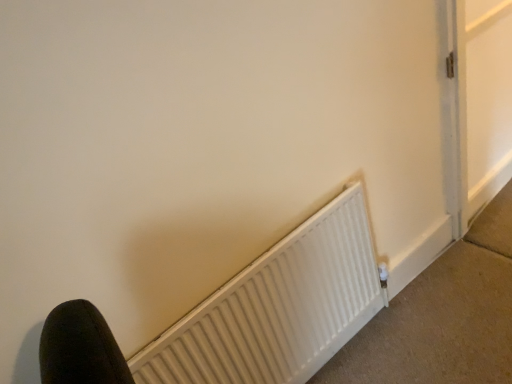
The image size is (512, 384). Describe the element at coordinates (278, 308) in the screenshot. I see `white matte radiator at lower center` at that location.

Where is `white matte radiator at lower center`? white matte radiator at lower center is located at coordinates click(x=278, y=308).

You are a GUI agent. You are given a task and a screenshot of the screen. Output one action in this format:
    pyautogui.click(x=<x>, y=<y>)
    Task: Click on the white matte radiator at lower center
    Image resolution: width=512 pixels, height=384 pixels.
    Given the screenshot: What is the action you would take?
    pyautogui.click(x=443, y=316)

What do you see at coordinates (443, 316) in the screenshot? I see `white matte radiator at lower center` at bounding box center [443, 316].

Where is `white matte radiator at lower center`? The height and width of the screenshot is (384, 512). white matte radiator at lower center is located at coordinates (278, 308).

Between white matte radiator at lower center and white matte radiator at lower center, which one appears on the left side from the viewer's perspective?

white matte radiator at lower center is more to the left.

Considering the relative positions of white matte radiator at lower center and white matte radiator at lower center in the image provided, is white matte radiator at lower center behind white matte radiator at lower center?

Yes, it is behind white matte radiator at lower center.

Is point (478, 274) closer or farther from the camera than point (276, 380)?

Point (478, 274) is positioned farther from the camera compared to point (276, 380).

From the image's perspective, between white matte radiator at lower center and white matte radiator at lower center, who is located below?

From the image's view, white matte radiator at lower center is below.

Looking at this image, from a real-world perspective, relative to white matte radiator at lower center, is white matte radiator at lower center vertically above or below?

From a real-world perspective, white matte radiator at lower center is physically below white matte radiator at lower center.

Considering the relative sizes of white matte radiator at lower center and white matte radiator at lower center in the image provided, is white matte radiator at lower center thinner than white matte radiator at lower center?

In fact, white matte radiator at lower center might be wider than white matte radiator at lower center.

Does white matte radiator at lower center have a lesser height compared to white matte radiator at lower center?

Correct, white matte radiator at lower center is not as tall as white matte radiator at lower center.

Based on the photo, who is bigger, white matte radiator at lower center or white matte radiator at lower center?

Bigger between the two is white matte radiator at lower center.

Is white matte radiator at lower center located outside white matte radiator at lower center?

Yes, white matte radiator at lower center is outside of white matte radiator at lower center.

Would you say white matte radiator at lower center is a long distance from white matte radiator at lower center?

Actually, white matte radiator at lower center and white matte radiator at lower center are a little close together.

Is white matte radiator at lower center facing away from white matte radiator at lower center?

white matte radiator at lower center is not turned away from white matte radiator at lower center.

How many degrees apart are the facing directions of white matte radiator at lower center and white matte radiator at lower center?

The facing directions of white matte radiator at lower center and white matte radiator at lower center are 89.8 degrees apart.

Locate an element on the screen. The height and width of the screenshot is (384, 512). concrete below the white matte radiator at lower center (from the image's perspective) is located at coordinates (443, 316).

Consider the image. Considering the relative positions of white matte radiator at lower center and white matte radiator at lower center in the image provided, is white matte radiator at lower center to the left or to the right of white matte radiator at lower center?

From the image, it's evident that white matte radiator at lower center is to the left of white matte radiator at lower center.

Consider the image. Considering their positions, is white matte radiator at lower center located in front of or behind white matte radiator at lower center?

Visually, white matte radiator at lower center is located in front of white matte radiator at lower center.

Does point (342, 227) come in front of point (433, 362)?

That is True.

From the image's perspective, is white matte radiator at lower center on white matte radiator at lower center?

Yes, from the image's perspective, white matte radiator at lower center is on top of white matte radiator at lower center.

From a real-world perspective, who is located lower, white matte radiator at lower center or white matte radiator at lower center?

From a 3D spatial view, white matte radiator at lower center is below.

Which of these two, white matte radiator at lower center or white matte radiator at lower center, is thinner?

white matte radiator at lower center is thinner.

Can you confirm if white matte radiator at lower center is taller than white matte radiator at lower center?

Correct, white matte radiator at lower center is much taller as white matte radiator at lower center.

Which of these two, white matte radiator at lower center or white matte radiator at lower center, is bigger?

With larger size is white matte radiator at lower center.

Is white matte radiator at lower center completely or partially outside of white matte radiator at lower center?

That's correct, white matte radiator at lower center is outside of white matte radiator at lower center.

Are white matte radiator at lower center and white matte radiator at lower center far apart?

No, white matte radiator at lower center is in close proximity to white matte radiator at lower center.

Is white matte radiator at lower center oriented towards white matte radiator at lower center?

Yes, white matte radiator at lower center is aimed at white matte radiator at lower center.

How many degrees apart are the facing directions of white matte radiator at lower center and white matte radiator at lower center?

There is a 89.8-degree angle between the facing directions of white matte radiator at lower center and white matte radiator at lower center.

In the image, there is a white matte radiator at lower center. Identify the location of concrete below it (from the image's perspective). This screenshot has width=512, height=384. (443, 316).

Locate an element on the screen. This screenshot has width=512, height=384. concrete behind the white matte radiator at lower center is located at coordinates (443, 316).

In the image, there is a white matte radiator at lower center. Identify the location of concrete below it (from the image's perspective). (443, 316).